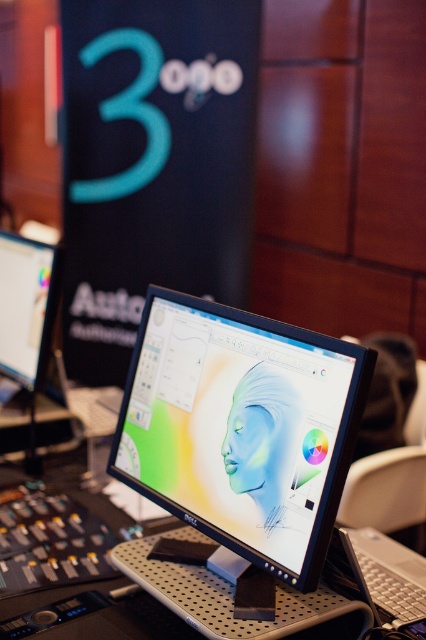
Looking at this image, you are setting up a dual monitor system and want to place a new monitor between the existing satin black monitor at center and the matte black monitor at left. Based on their current positions, which monitor should the new monitor be placed closer to?

The new monitor should be placed closer to the matte black monitor at left because the satin black monitor at center is closer to the viewer, so positioning the new monitor near the matte black monitor at left would maintain a balanced setup.